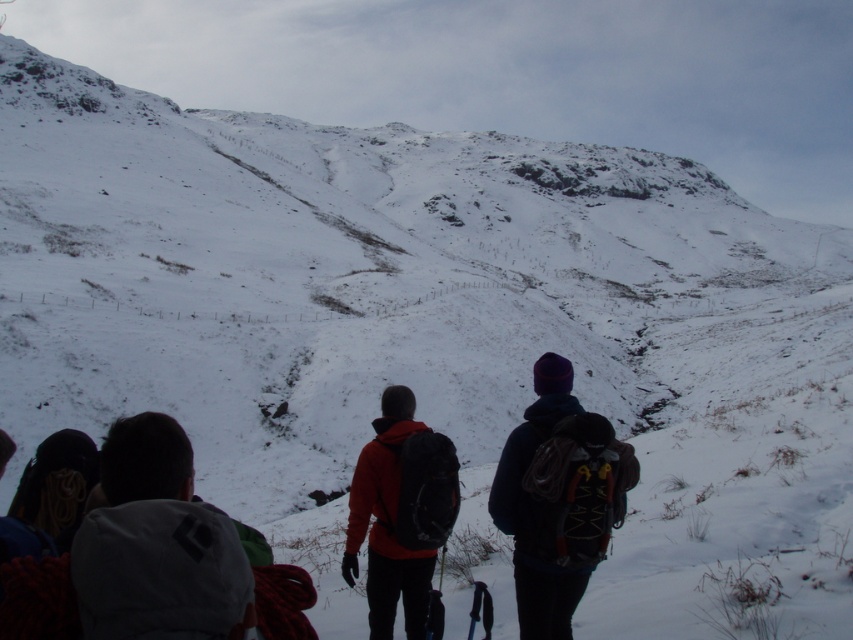
Who is lower down, white fleece jacket at lower left or dark blue fleece jacket at center?

dark blue fleece jacket at center

This screenshot has width=853, height=640. What do you see at coordinates (157, 545) in the screenshot?
I see `white fleece jacket at lower left` at bounding box center [157, 545].

Who is more distant from viewer, (x=117, y=456) or (x=544, y=547)?

Point (x=544, y=547)

Find the location of a particular element. The width and height of the screenshot is (853, 640). white fleece jacket at lower left is located at coordinates (157, 545).

Which is below, white fleece jacket at lower left or matte orange jacket at center?

matte orange jacket at center

Locate an element on the screen. The height and width of the screenshot is (640, 853). white fleece jacket at lower left is located at coordinates (157, 545).

Is dark blue fleece jacket at center below matte orange jacket at center?

No.

Which is in front, point (527, 410) or point (419, 499)?

Point (419, 499) is in front.

Locate an element on the screen. dark blue fleece jacket at center is located at coordinates coord(558,499).